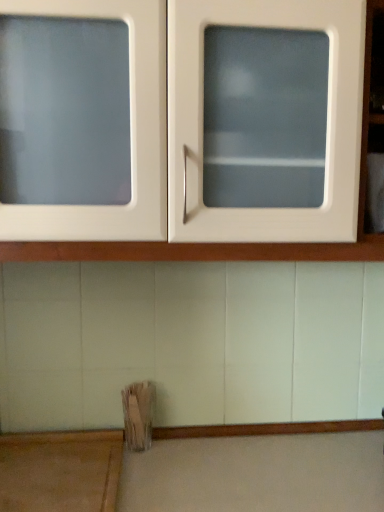
Question: In terms of width, does wooden at lower left look wider or thinner when compared to white glossy cabinet at upper center?

Choices:
 (A) thin
 (B) wide

Answer: (A)

Question: Relative to white glossy cabinet at upper center, is wooden at lower left in front or behind?

Choices:
 (A) front
 (B) behind

Answer: (B)

Question: From a real-world perspective, relative to white glossy cabinet at upper center, is wooden at lower left vertically above or below?

Choices:
 (A) above
 (B) below

Answer: (B)

Question: In terms of size, does white glossy cabinet at upper center appear bigger or smaller than wooden at lower left?

Choices:
 (A) small
 (B) big

Answer: (B)

Question: Considering the positions of white glossy cabinet at upper center and wooden at lower left in the image, is white glossy cabinet at upper center wider or thinner than wooden at lower left?

Choices:
 (A) thin
 (B) wide

Answer: (B)

Question: Is point (193, 244) positioned closer to the camera than point (48, 465)?

Choices:
 (A) farther
 (B) closer

Answer: (B)

Question: In the image, is white glossy cabinet at upper center on the left side or the right side of wooden at lower left?

Choices:
 (A) left
 (B) right

Answer: (B)